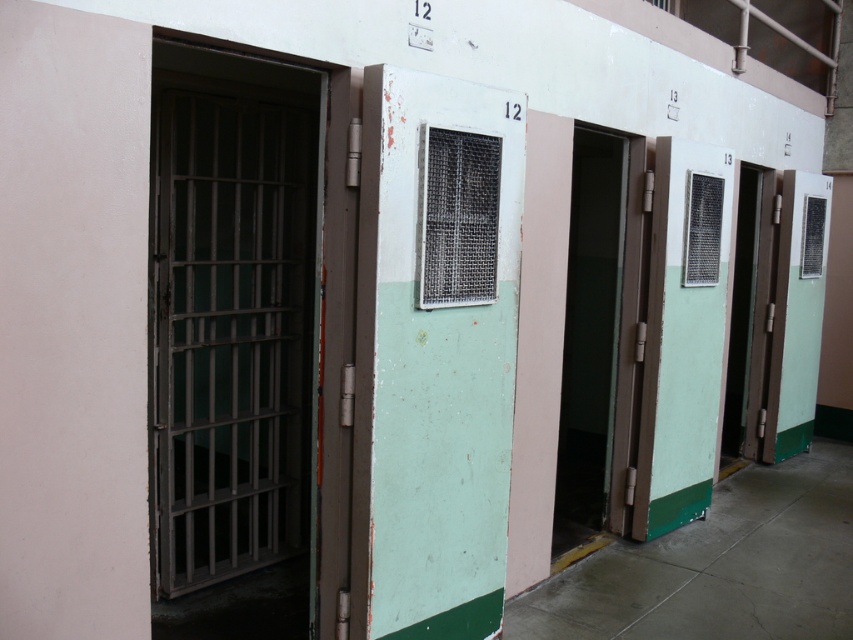
Which is in front, point (170, 275) or point (589, 243)?

Point (170, 275) is in front.

Does point (154, 465) lie in front of point (569, 525)?

Yes, it is.

Where is `metallic gray bars at left`? metallic gray bars at left is located at coordinates (231, 317).